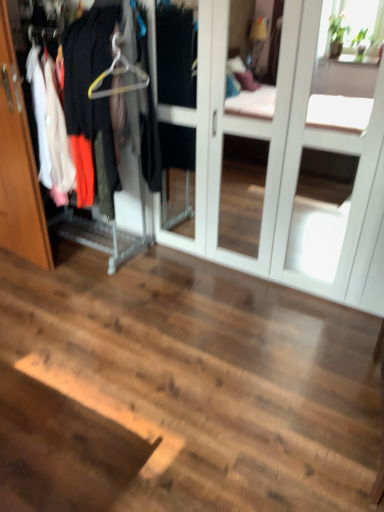
Where is `free space in front of metallic hanger at left`? This screenshot has width=384, height=512. free space in front of metallic hanger at left is located at coordinates [81, 306].